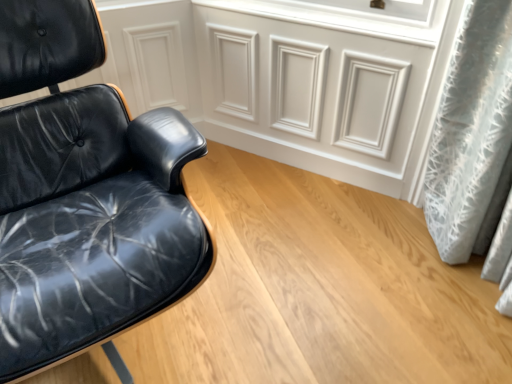
Question: Considering the relative sizes of white matte panel at upper center and black leather chair at left in the image provided, is white matte panel at upper center taller than black leather chair at left?

Choices:
 (A) no
 (B) yes

Answer: (A)

Question: Is white matte panel at upper center bigger than black leather chair at left?

Choices:
 (A) no
 (B) yes

Answer: (A)

Question: Is black leather chair at left inside white matte panel at upper center?

Choices:
 (A) no
 (B) yes

Answer: (A)

Question: From the image's perspective, would you say white matte panel at upper center is positioned over black leather chair at left?

Choices:
 (A) no
 (B) yes

Answer: (B)

Question: Does white matte panel at upper center turn towards black leather chair at left?

Choices:
 (A) no
 (B) yes

Answer: (B)

Question: Is white matte panel at upper center looking in the opposite direction of black leather chair at left?

Choices:
 (A) no
 (B) yes

Answer: (A)

Question: Does black leather chair at left have a smaller size compared to white matte panel at upper center?

Choices:
 (A) yes
 (B) no

Answer: (B)

Question: Is black leather chair at left taller than white matte panel at upper center?

Choices:
 (A) yes
 (B) no

Answer: (A)

Question: Would you consider black leather chair at left to be distant from white matte panel at upper center?

Choices:
 (A) no
 (B) yes

Answer: (A)

Question: From a real-world perspective, is black leather chair at left on top of white matte panel at upper center?

Choices:
 (A) yes
 (B) no

Answer: (A)

Question: Considering the relative sizes of black leather chair at left and white matte panel at upper center in the image provided, is black leather chair at left wider than white matte panel at upper center?

Choices:
 (A) yes
 (B) no

Answer: (A)

Question: From the image's perspective, is black leather chair at left located beneath white matte panel at upper center?

Choices:
 (A) no
 (B) yes

Answer: (B)

Question: From a real-world perspective, is white matte panel at upper center above or below black leather chair at left?

Choices:
 (A) above
 (B) below

Answer: (B)